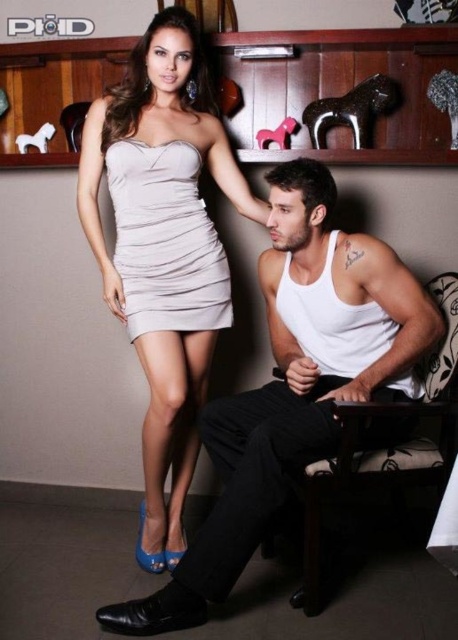
Is point (186, 86) positioned before point (447, 364)?

No.

Locate an element on the screen. Image resolution: width=458 pixels, height=640 pixels. satin beige dress at upper left is located at coordinates pos(163,250).

Between satin dress at center and white fabric chair at lower right, which one has less height?

With less height is satin dress at center.

Is satin dress at center closer to camera compared to white fabric chair at lower right?

That is False.

This screenshot has width=458, height=640. Find the location of `satin dress at center`. satin dress at center is located at coordinates (165, 241).

Image resolution: width=458 pixels, height=640 pixels. Find the location of `satin dress at center`. satin dress at center is located at coordinates click(165, 241).

Image resolution: width=458 pixels, height=640 pixels. What do you see at coordinates (294, 385) in the screenshot?
I see `white matte tank top at center` at bounding box center [294, 385].

Is white matte tank top at center thinner than satin dress at center?

No, white matte tank top at center is not thinner than satin dress at center.

Which is behind, point (327, 342) or point (163, 164)?

Point (163, 164)

At what (x,y) coordinates should I click in order to perform the action: click on white matte tank top at center. Please return your answer as a coordinate pair (x, y). The image size is (458, 640). Looking at the image, I should click on (294, 385).